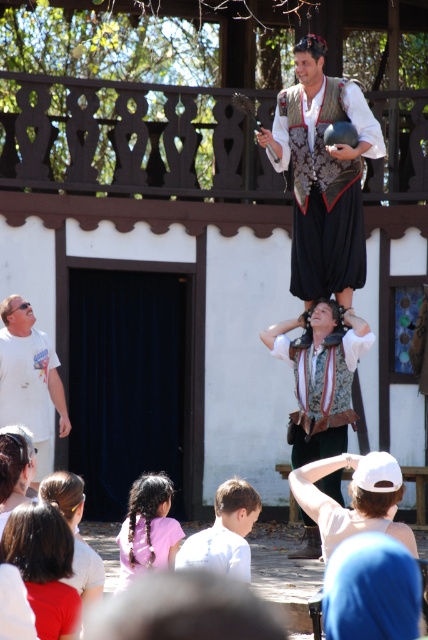
Is white cotton cap at lower right taller than pink fabric hair at lower left?

Correct, white cotton cap at lower right is much taller as pink fabric hair at lower left.

From the picture: Can you confirm if white cotton cap at lower right is positioned to the left of pink fabric hair at lower left?

In fact, white cotton cap at lower right is to the right of pink fabric hair at lower left.

The height and width of the screenshot is (640, 428). What do you see at coordinates (351, 499) in the screenshot?
I see `white cotton cap at lower right` at bounding box center [351, 499].

At what (x,y) coordinates should I click in order to perform the action: click on white cotton cap at lower right. Please return your answer as a coordinate pair (x, y). The image size is (428, 640). Looking at the image, I should click on (351, 499).

Who is more forward, (365, 563) or (130, 563)?

Point (365, 563) is more forward.

Is point (345, 564) closer to camera compared to point (122, 570)?

Yes, it is.

Image resolution: width=428 pixels, height=640 pixels. What are the coordinates of `blue fabric at lower right` in the screenshot? It's located at (371, 589).

In the scene shown: Who is positioned more to the right, matte brown vest at center or white cotton cap at lower right?

white cotton cap at lower right is more to the right.

How much distance is there between matte brown vest at center and white cotton cap at lower right?

They are 10.44 feet apart.

The image size is (428, 640). Find the location of `matte brown vest at center`. matte brown vest at center is located at coordinates (321, 394).